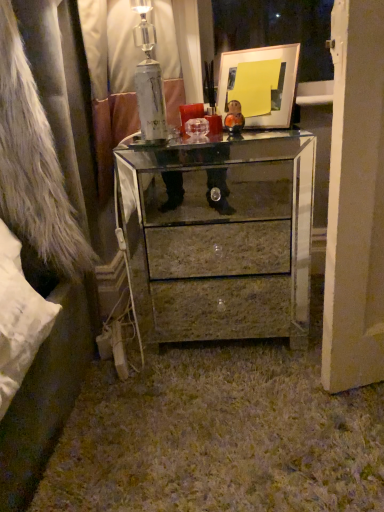
The width and height of the screenshot is (384, 512). What do you see at coordinates (260, 84) in the screenshot?
I see `matte gold picture frame at upper center` at bounding box center [260, 84].

Measure the distance between point (176, 229) and camera.

6.46 feet.

Find the location of a particular element. brown marble drawer at center is located at coordinates click(x=219, y=250).

At what (x,y) coordinates should I click in order to perform the action: click on matte gold picture frame at upper center. Please return your answer as a coordinate pair (x, y). Looking at the image, I should click on (260, 84).

From a real-world perspective, is matte gold picture frame at upper center located higher than brown marble drawer at center?

Yes.

Is matte gold picture frame at upper center not inside brown marble drawer at center?

Yes.

Which is less distant, (251, 119) or (285, 236)?

Clearly, point (251, 119) is closer to the camera than point (285, 236).

From the picture: From the image's perspective, between mirrored glass chest of drawers at center and brown marble drawer at center, who is located below?

brown marble drawer at center appears lower in the image.

In the scene shown: Is mirrored glass chest of drawers at center turned away from brown marble drawer at center?

Yes, brown marble drawer at center is at the back of mirrored glass chest of drawers at center.

Can you tell me how much mirrored glass chest of drawers at center and brown marble drawer at center differ in facing direction?

They differ by 0.834 degrees in their facing directions.

Looking at this image, from a real-world perspective, is mirrored glass chest of drawers at center beneath brown marble drawer at center?

No, from a real-world perspective, mirrored glass chest of drawers at center is not beneath brown marble drawer at center.

Measure the distance between brown marble drawer at center and mirrored glass chest of drawers at center.

The distance of brown marble drawer at center from mirrored glass chest of drawers at center is 5.56 inches.

What's the angular difference between brown marble drawer at center and mirrored glass chest of drawers at center's facing directions?

The angular difference between brown marble drawer at center and mirrored glass chest of drawers at center is 0.834 degrees.

Is brown marble drawer at center touching mirrored glass chest of drawers at center?

brown marble drawer at center is not next to mirrored glass chest of drawers at center, and they're not touching.

Is brown marble drawer at center positioned in front of mirrored glass chest of drawers at center?

No, brown marble drawer at center is behind mirrored glass chest of drawers at center.

Is mirrored glass chest of drawers at center closer to the viewer compared to matte gold picture frame at upper center?

Yes, the depth of mirrored glass chest of drawers at center is less than that of matte gold picture frame at upper center.

I want to click on chest of drawers located on the left of matte gold picture frame at upper center, so click(230, 239).

Considering the relative sizes of mirrored glass chest of drawers at center and matte gold picture frame at upper center in the image provided, is mirrored glass chest of drawers at center smaller than matte gold picture frame at upper center?

Actually, mirrored glass chest of drawers at center might be larger than matte gold picture frame at upper center.

Is mirrored glass chest of drawers at center inside or outside of matte gold picture frame at upper center?

The correct answer is: outside.

Does brown marble drawer at center turn towards matte gold picture frame at upper center?

No.

Is brown marble drawer at center spatially inside matte gold picture frame at upper center, or outside of it?

brown marble drawer at center lies outside matte gold picture frame at upper center.

Can you confirm if brown marble drawer at center is positioned to the left of matte gold picture frame at upper center?

Indeed, brown marble drawer at center is positioned on the left side of matte gold picture frame at upper center.

Which object is wider, brown marble drawer at center or matte gold picture frame at upper center?

matte gold picture frame at upper center is wider.

Is matte gold picture frame at upper center situated inside mirrored glass chest of drawers at center or outside?

matte gold picture frame at upper center lies outside mirrored glass chest of drawers at center.

From a real-world perspective, is matte gold picture frame at upper center positioned over mirrored glass chest of drawers at center based on gravity?

Yes.

Which object is positioned more to the right, matte gold picture frame at upper center or mirrored glass chest of drawers at center?

From the viewer's perspective, matte gold picture frame at upper center appears more on the right side.

In the image, there is a brown marble drawer at center. Identify the location of picture frame above it (from the image's perspective). This screenshot has height=512, width=384. (260, 84).

I want to click on chest of drawers lying on the left of brown marble drawer at center, so click(230, 239).

Looking at the image, which one is located further to matte gold picture frame at upper center, mirrored glass chest of drawers at center or brown marble drawer at center?

The object further to matte gold picture frame at upper center is brown marble drawer at center.

From the picture: Looking at the image, which one is located further to matte gold picture frame at upper center, brown marble drawer at center or mirrored glass chest of drawers at center?

The object further to matte gold picture frame at upper center is brown marble drawer at center.

Estimate the real-world distances between objects in this image. Which object is closer to mirrored glass chest of drawers at center, matte gold picture frame at upper center or brown marble drawer at center?

Among the two, brown marble drawer at center is located nearer to mirrored glass chest of drawers at center.

Based on their spatial positions, is brown marble drawer at center or matte gold picture frame at upper center further from mirrored glass chest of drawers at center?

matte gold picture frame at upper center is positioned further to the anchor mirrored glass chest of drawers at center.

Based on their spatial positions, is matte gold picture frame at upper center or mirrored glass chest of drawers at center closer to brown marble drawer at center?

mirrored glass chest of drawers at center is closer to brown marble drawer at center.

Considering their positions, is mirrored glass chest of drawers at center positioned closer to brown marble drawer at center than matte gold picture frame at upper center?

Based on the image, mirrored glass chest of drawers at center appears to be nearer to brown marble drawer at center.

Where is `picture frame between mirrored glass chest of drawers at center and brown marble drawer at center from front to back`? This screenshot has height=512, width=384. picture frame between mirrored glass chest of drawers at center and brown marble drawer at center from front to back is located at coordinates (260, 84).